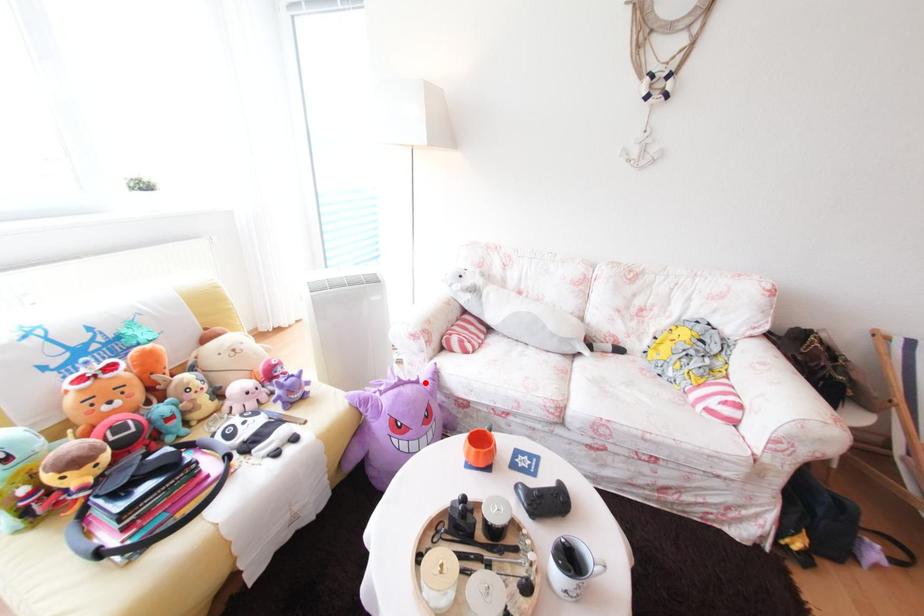
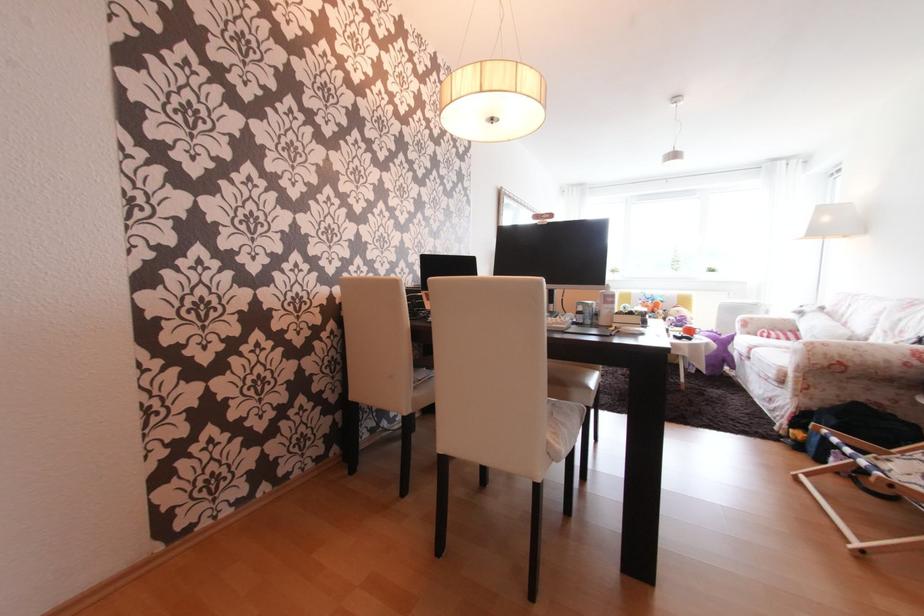
The point at the highlighted location is marked in the first image. Where is the corresponding point in the second image?

(727, 336)